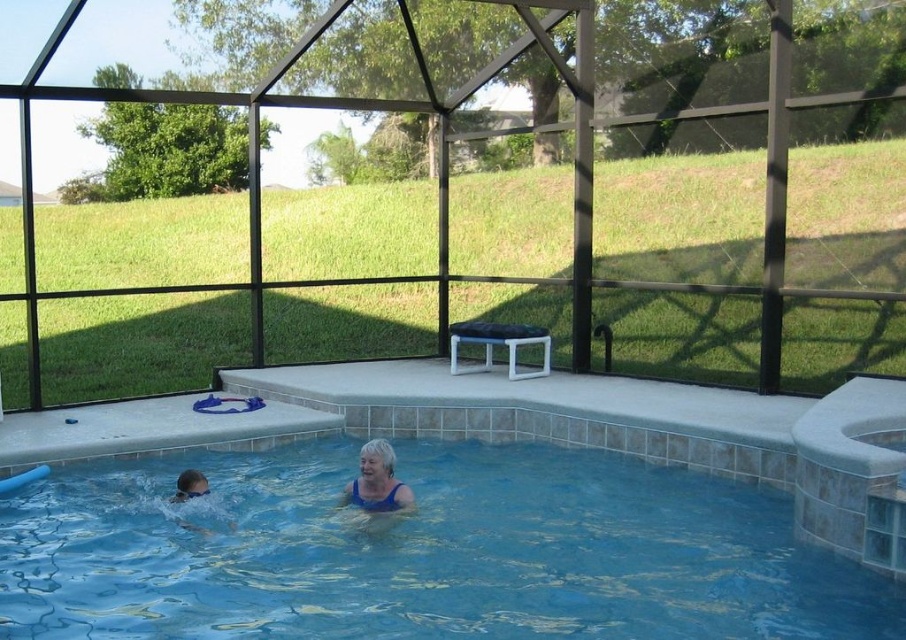
You are designing a new pool float that needs to accommodate both the blue fabric person at center and the smooth blue swim cap at lower left. Which object requires a larger float size based on their dimensions?

The blue fabric person at center requires a larger float size because their width is greater than the smooth blue swim cap at lower left.

You are a lifeguard standing at the edge of the pool. You need to place a floating rescue buoy in the water. Considering the blue glossy water at center and the smooth blue swim cap at lower left, which area would you choose to place it so it is more visible to swimmers?

The blue glossy water at center has a larger size compared to the smooth blue swim cap at lower left, so placing the floating rescue buoy in the blue glossy water at center would make it more visible to swimmers due to its spacious area.